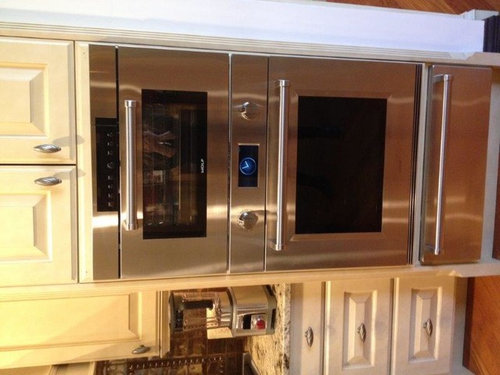
Identify the location of granite counter top. The height and width of the screenshot is (375, 500). (270, 359), (283, 301).